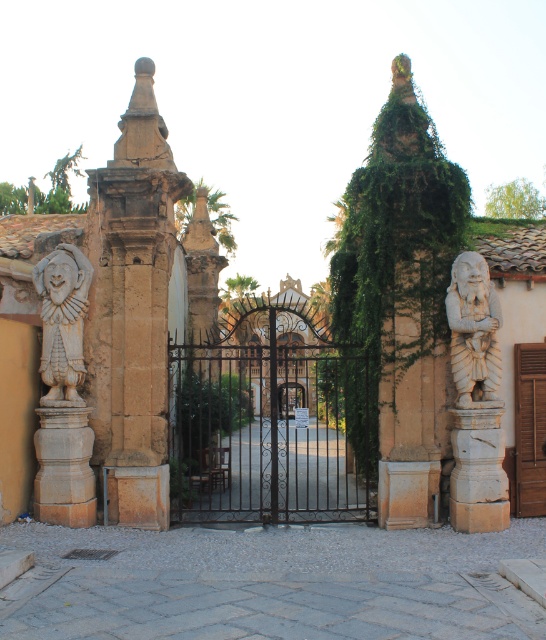
Between white stone dwarf at right and brown wooden door at right, which one appears on the right side from the viewer's perspective?

brown wooden door at right

You are a GUI agent. You are given a task and a screenshot of the screen. Output one action in this format:
    pyautogui.click(x=<x>, y=<y>)
    Task: Click on the white stone dwarf at right
    This screenshot has height=640, width=546.
    Given the screenshot: What is the action you would take?
    pyautogui.click(x=473, y=332)

Who is positioned more to the right, stone clown at left or brown wooden door at right?

brown wooden door at right

Where is `stone clown at left`? Image resolution: width=546 pixels, height=640 pixels. stone clown at left is located at coordinates (62, 321).

Where is `stone clown at left`? The height and width of the screenshot is (640, 546). stone clown at left is located at coordinates (62, 321).

Looking at this image, is stone clown at left shorter than white stone dwarf at right?

In fact, stone clown at left may be taller than white stone dwarf at right.

Does point (68, 403) lie in front of point (477, 388)?

That is True.

Where is `stone clown at left`? The width and height of the screenshot is (546, 640). stone clown at left is located at coordinates (62, 321).